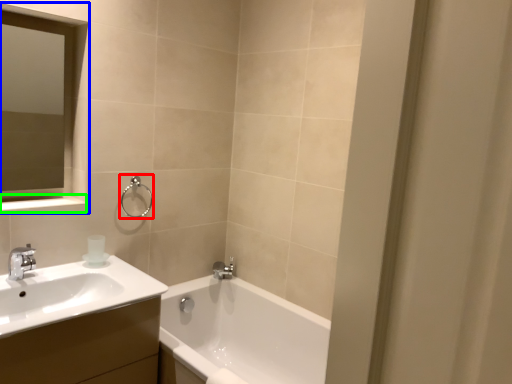
Question: Estimate the real-world distances between objects in this image. Which object is closer to shower (highlighted by a red box), medicine cabinet (highlighted by a blue box) or balustrade (highlighted by a green box)?

Choices:
 (A) medicine cabinet
 (B) balustrade

Answer: (B)